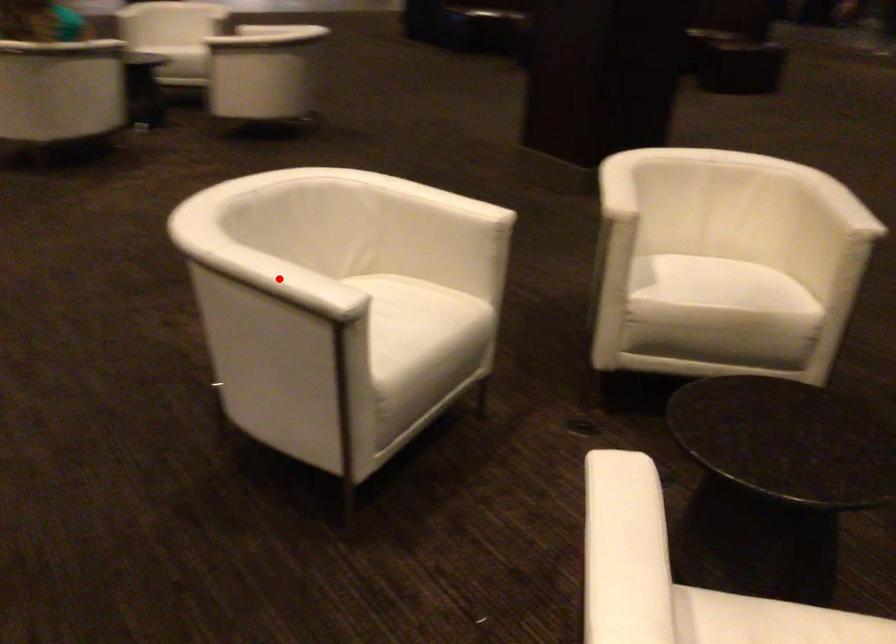
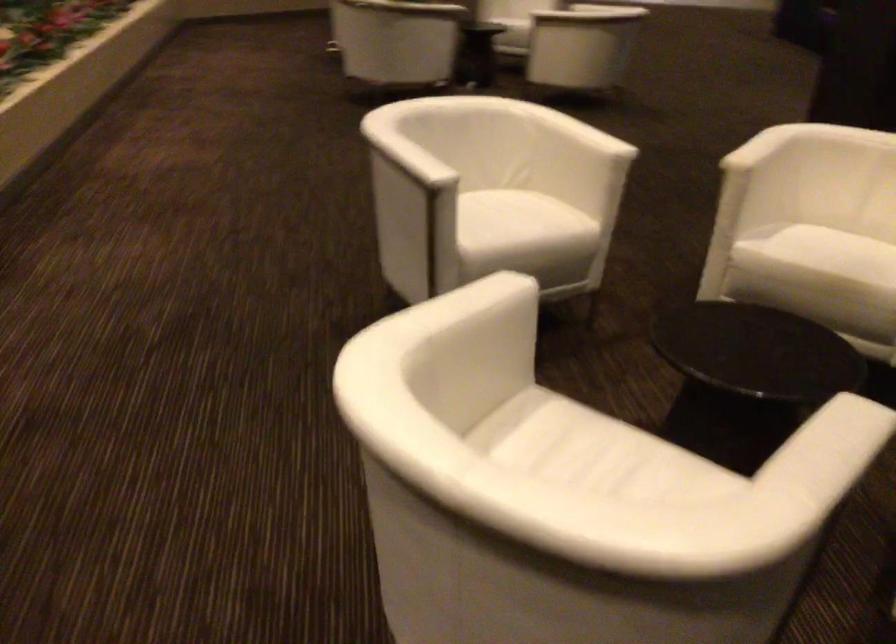
Find the pixel in the second image that matches the highlighted location in the first image.

(406, 158)